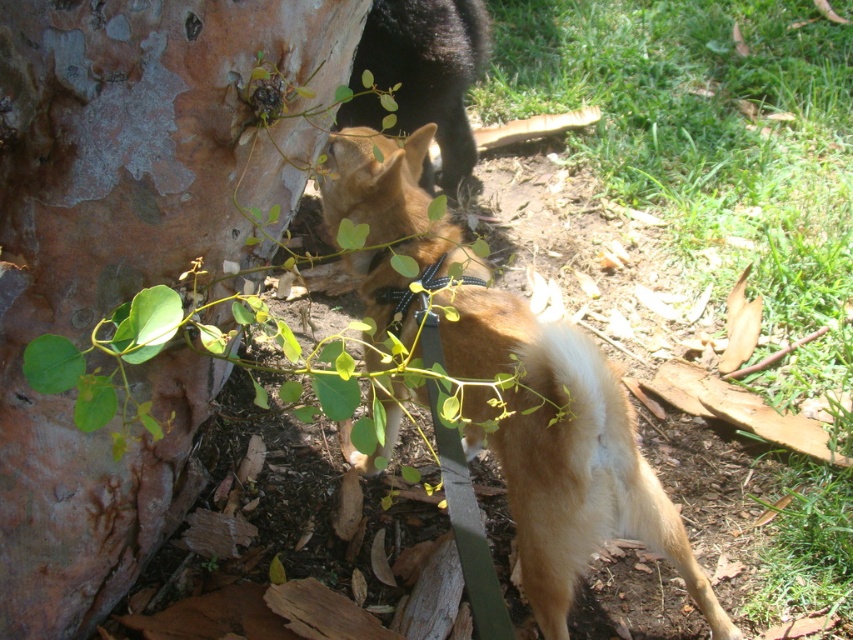
Is smooth bark tree trunk at left to the left of golden fur dog at center from the viewer's perspective?

Indeed, smooth bark tree trunk at left is positioned on the left side of golden fur dog at center.

Which of these two, smooth bark tree trunk at left or golden fur dog at center, stands taller?

smooth bark tree trunk at left

What do you see at coordinates (126, 253) in the screenshot? Image resolution: width=853 pixels, height=640 pixels. I see `smooth bark tree trunk at left` at bounding box center [126, 253].

Identify the location of smooth bark tree trunk at left. (126, 253).